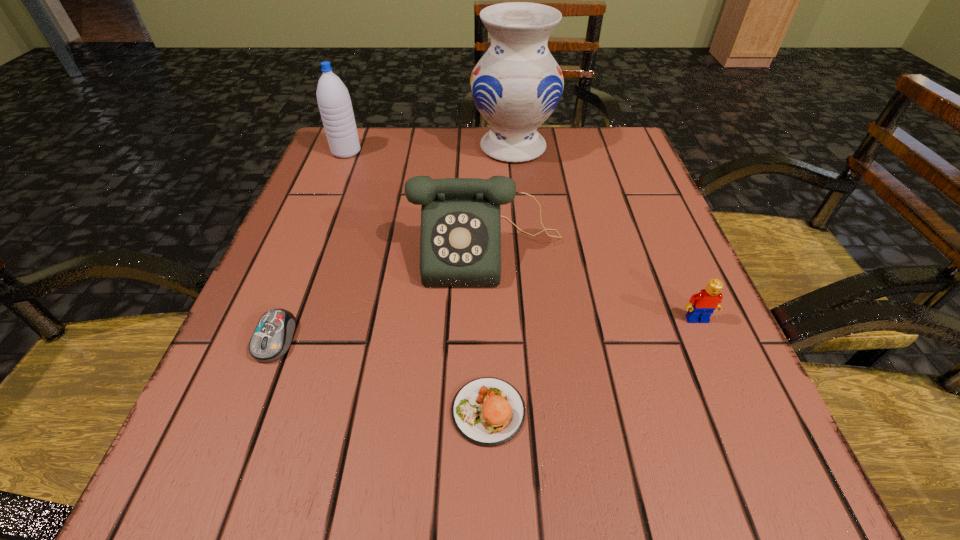
You are a GUI agent. You are given a task and a screenshot of the screen. Output one action in this format:
    pyautogui.click(x=<x>, y=<y>)
    Task: Click on the vase
    
    Given the screenshot: What is the action you would take?
    pyautogui.click(x=516, y=85)

The image size is (960, 540). I want to click on the fifth shortest object, so click(x=333, y=98).

This screenshot has height=540, width=960. In order to click on telephone in this screenshot , I will do `click(460, 241)`.

What are the coordinates of `the third farthest object` in the screenshot? It's located at (460, 241).

Where is `Lego`? Lego is located at coordinates (701, 305).

You are a GUI agent. You are given a task and a screenshot of the screen. Output one action in this format:
    pyautogui.click(x=<x>, y=<y>)
    Task: Click on the rightmost object
    
    Given the screenshot: What is the action you would take?
    pyautogui.click(x=701, y=305)

Locate an element on the screen. This screenshot has width=960, height=540. patty is located at coordinates (487, 411).

This screenshot has height=540, width=960. What are the coordinates of `computer mouse` in the screenshot? It's located at (272, 337).

Find the location of a particular element. This screenshot has width=960, height=540. free spot located on the left of the tallest object is located at coordinates (450, 147).

You are a GUI agent. You are given a task and a screenshot of the screen. Output one action in this format:
    pyautogui.click(x=<x>, y=<y>)
    Task: Click on the vacant area situated 0.060m on the back of the water bottle
    This screenshot has width=960, height=540.
    Given the screenshot: What is the action you would take?
    pyautogui.click(x=354, y=132)